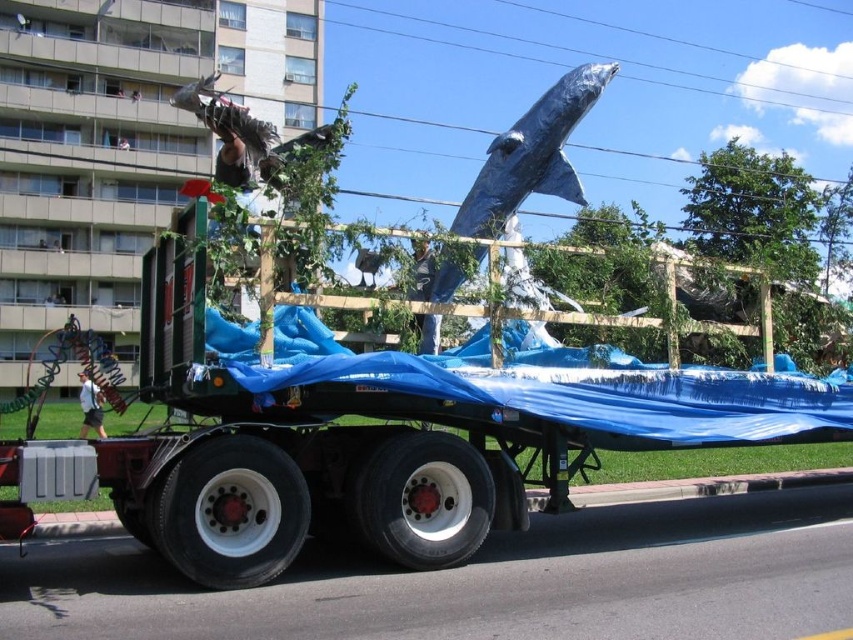
You are a photographer trying to capture the blue metallic whale at upper center and the green leafy tree at upper right in the same frame. Which object will appear bigger in your photo?

The green leafy tree at upper right will appear bigger in the photo because it has a larger size compared to the blue metallic whale at upper center according to the description.

You are a photographer standing on the sidewalk. You want to take a photo of the blue metallic whale at upper center without any obstructions. Is the green leafy tree at upper right blocking your view of the whale?

The blue metallic whale at upper center is behind the green leafy tree at upper right, so the tree is blocking the view of the whale.

From the picture: You are standing in front of the truck carrying the whale sculpture. You notice two points marked on the sculpture. One is at coordinate point [788,182] and the other at point [430,323]. Which point is closer to your eyes?

Point [788,182] is further to the camera than point [430,323], so the point closer to your eyes is point [430,323].